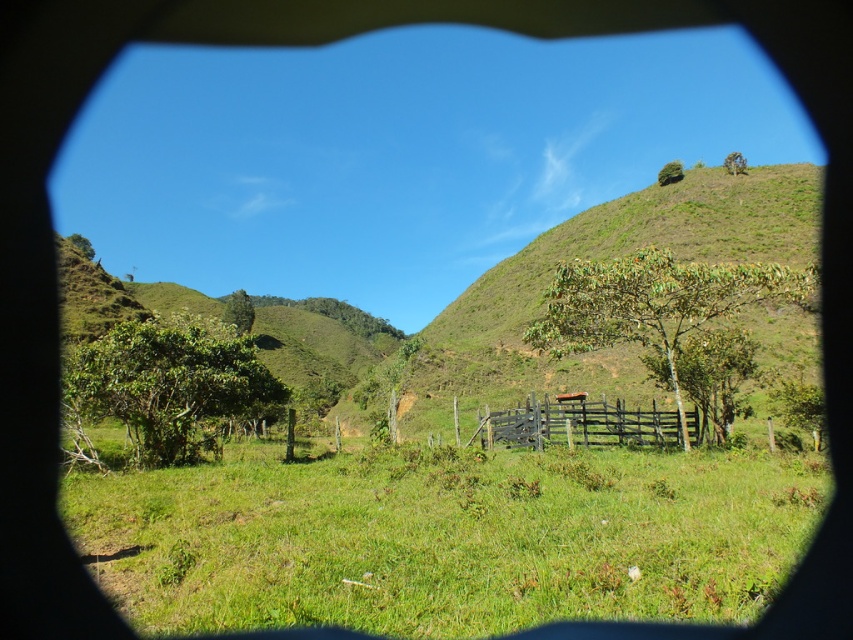
You are standing in a rural area and see the green grassy field at center and the wooden fence at center. Which object is positioned to the left of the other?

The green grassy field at center is to the left of the wooden fence at center.